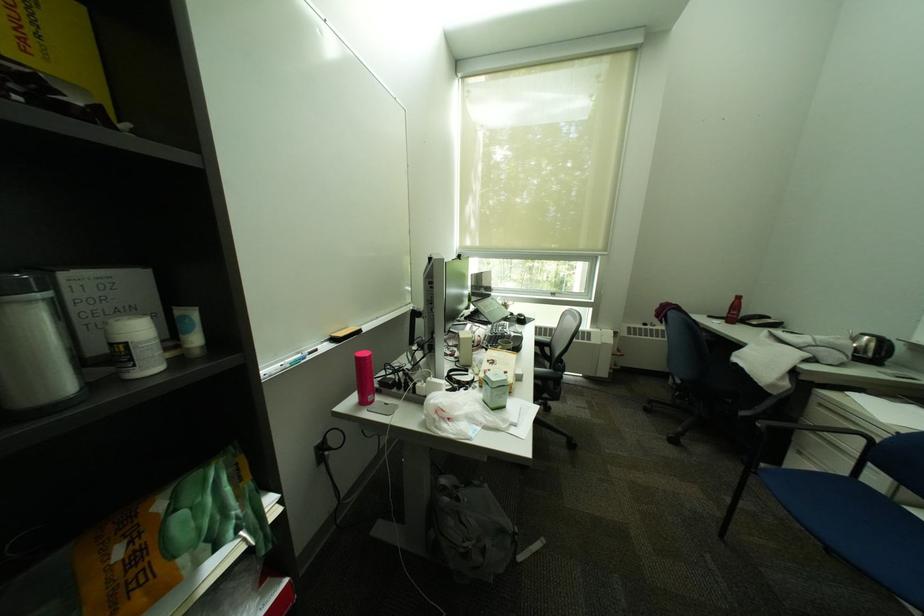
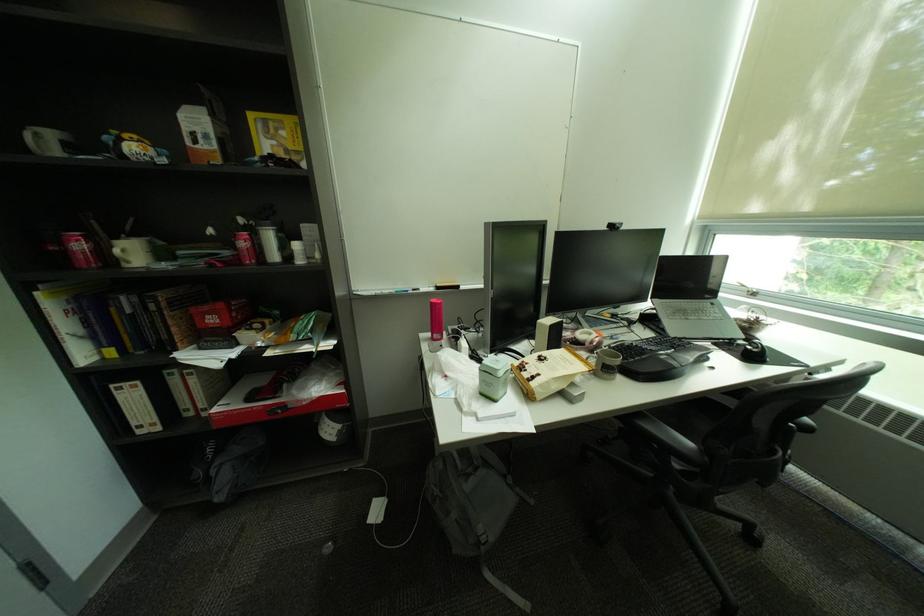
Find the pixel in the second image that matches point 351,336 in the first image.

(450, 286)